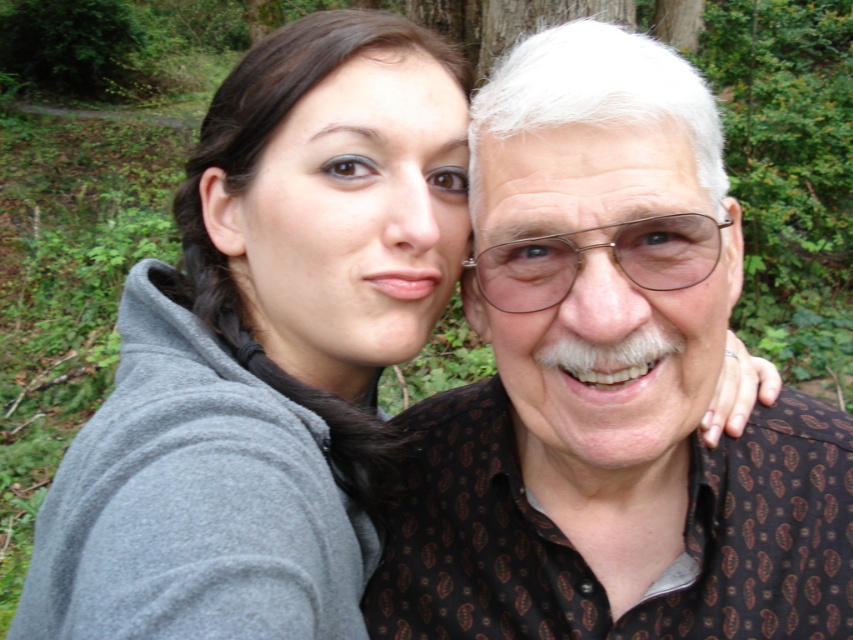
Based on the scene description, which object is shorter in height between the brown patterned shirt at center and the gray fleece jacket at upper left?

The brown patterned shirt at center is shorter in height than the gray fleece jacket at upper left.

You are a photographer trying to capture the perfect shot of the brown patterned shirt at center. What are the coordinates where you should focus your camera?

The coordinates for the brown patterned shirt at center are at point (608, 385).